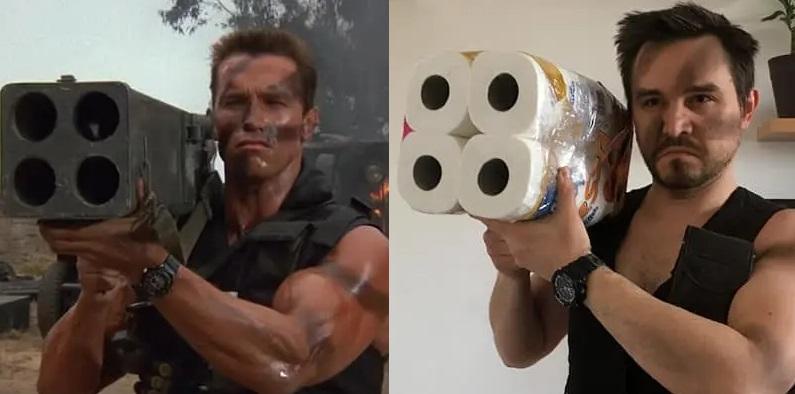
The width and height of the screenshot is (795, 394). In order to click on green plant in this screenshot , I will do `click(793, 26)`.